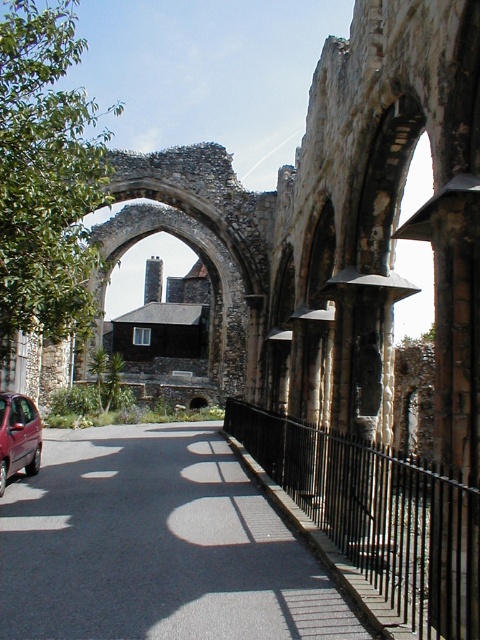
You are a pedestrian standing on the black asphalt road at center. You want to cross the street to reach the historical archway. Is the metallic maroon car at lower left blocking your path?

The black asphalt road at center is below metallic maroon car at lower left, so the car is parked on the road. Since the car is on the road, it may block your path depending on its position. However, the description only states the car is at lower left and the road is at center. Without more details on the exact positioning, it is unclear if the car directly blocks the path to the archway.

You are a pedestrian standing at the intersection near the historical stone archway. You see the black asphalt road at center and the metallic maroon car at lower left. Which object is positioned to the right of the other?

The black asphalt road at center is to the right of the metallic maroon car at lower left.